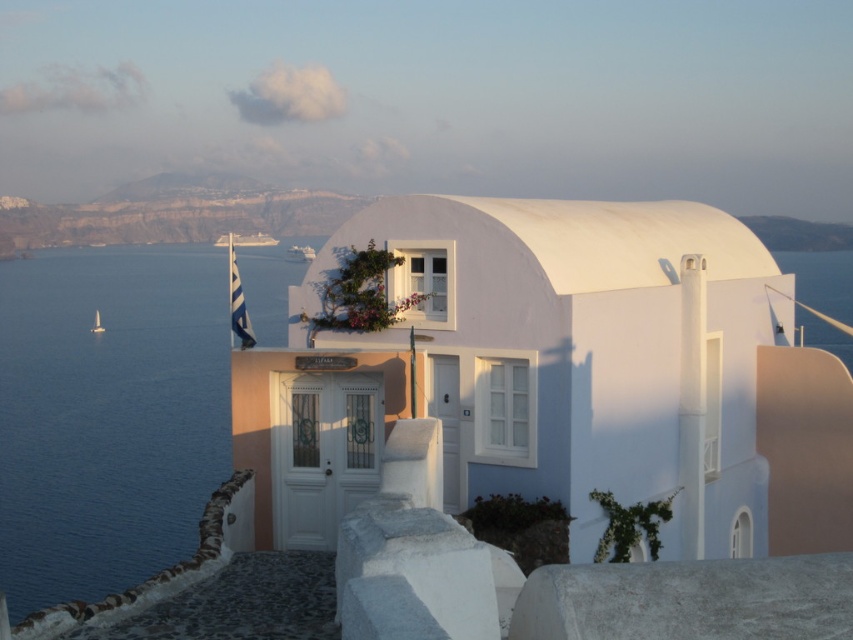
Does white matte building at center have a greater height compared to blue water at left?

No.

Who is positioned more to the right, white matte building at center or blue water at left?

white matte building at center

Between point (706, 541) and point (137, 253), which one is positioned behind?

The point (137, 253) is behind.

Image resolution: width=853 pixels, height=640 pixels. What are the coordinates of `white matte building at center` in the screenshot? It's located at (560, 376).